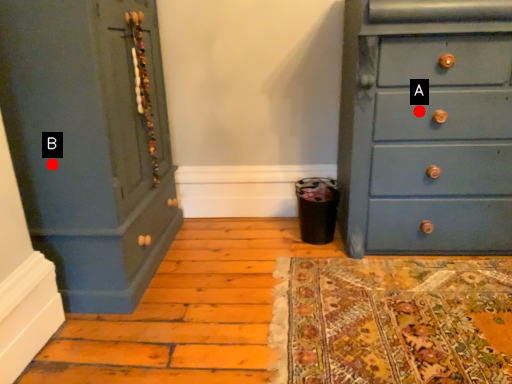
Question: Two points are circled on the image, labeled by A and B beside each circle. Which point appears farthest from the camera in this image?

Choices:
 (A) A is further
 (B) B is further

Answer: (A)